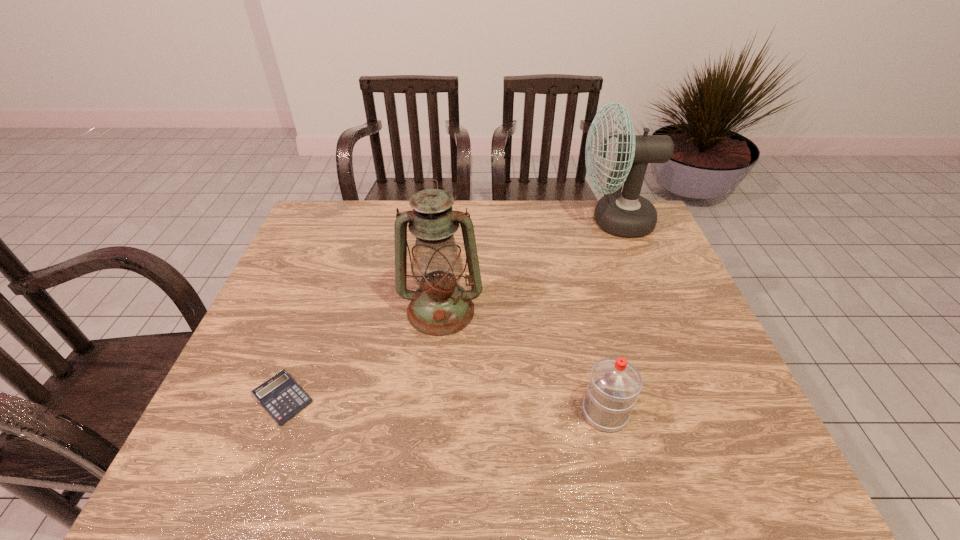
In the image, there is a desktop. Where is `vacant space at the far edge`? vacant space at the far edge is located at coordinates (525, 201).

What are the coordinates of `vacant region at the near edge of the desktop` in the screenshot? It's located at (280, 447).

Find the location of `free space at the left edge`. free space at the left edge is located at coordinates (284, 299).

At what (x,y) coordinates should I click in order to perform the action: click on free region at the right edge of the desktop. Please return your answer as a coordinate pair (x, y). Image resolution: width=960 pixels, height=540 pixels. Looking at the image, I should click on (663, 361).

Identify the location of vacant area at the near left corner. Image resolution: width=960 pixels, height=540 pixels. (222, 476).

Where is `vacant area between the shortest object and the second farthest object`? The width and height of the screenshot is (960, 540). vacant area between the shortest object and the second farthest object is located at coordinates (362, 355).

Where is `vacant space in between the second object from left to right and the water bottle`? Image resolution: width=960 pixels, height=540 pixels. vacant space in between the second object from left to right and the water bottle is located at coordinates (523, 361).

Locate an element on the screen. vacant area that lies between the oil lamp and the leftmost object is located at coordinates (362, 355).

You are a GUI agent. You are given a task and a screenshot of the screen. Output one action in this format:
    pyautogui.click(x=<x>, y=<y>)
    Task: Click on the free space that is in between the farthest object and the second farthest object
    This screenshot has width=960, height=540.
    Given the screenshot: What is the action you would take?
    pyautogui.click(x=528, y=266)

Image resolution: width=960 pixels, height=540 pixels. What are the coordinates of `free spot between the calculator and the oil lamp` in the screenshot? It's located at pos(362,355).